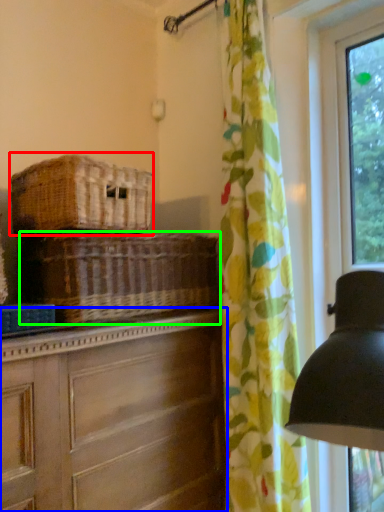
Question: Which is farther away from basket (highlighted by a red box)? chest of drawers (highlighted by a blue box) or basket (highlighted by a green box)?

Choices:
 (A) chest of drawers
 (B) basket

Answer: (A)